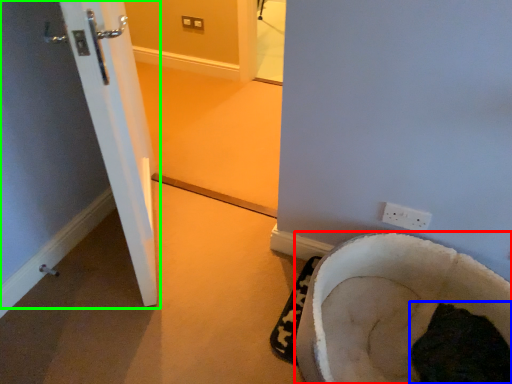
Question: Estimate the real-world distances between objects in this image. Which object is farther from furniture (highlighted by a red box), animal (highlighted by a blue box) or door (highlighted by a green box)?

Choices:
 (A) animal
 (B) door

Answer: (B)